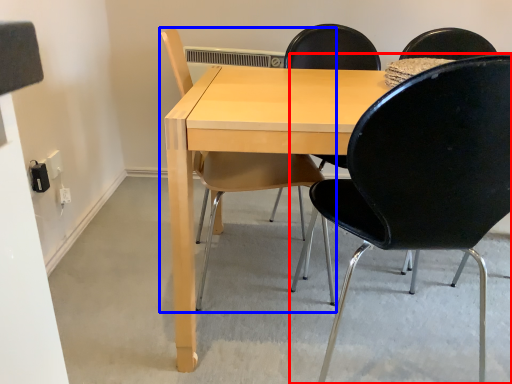
Question: Which object is closer to the camera taking this photo, chair (highlighted by a red box) or chair (highlighted by a blue box)?

Choices:
 (A) chair
 (B) chair

Answer: (A)